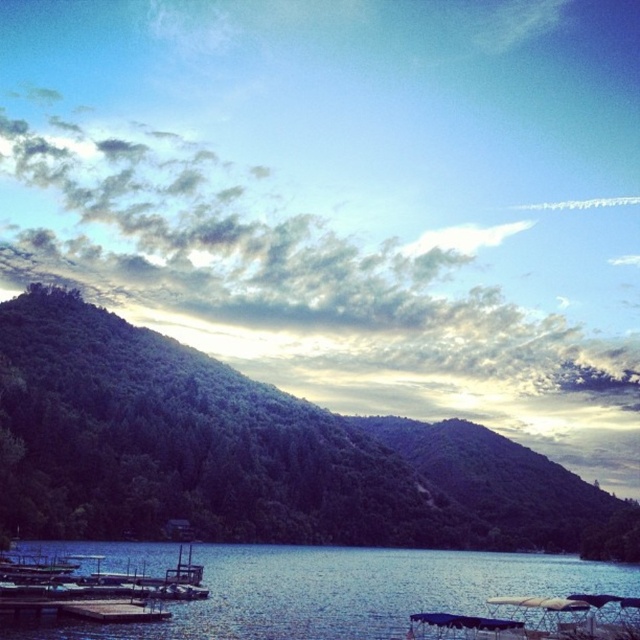
Based on the scene description, where is the green forested hill at center located in terms of coordinates?

The green forested hill at center is located at coordinates point (257,452).

You are standing at the lakeside and want to walk towards the green forested hill at center and the blue water at lower center. Which one will you reach first?

You will reach the blue water at lower center first because the green forested hill at center is further away from you, so the blue water at lower center is closer.